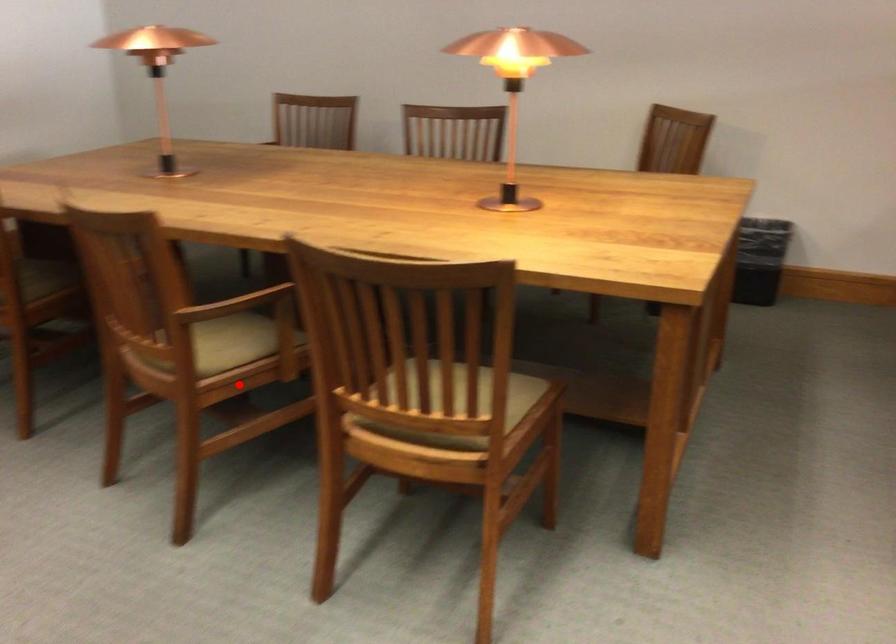
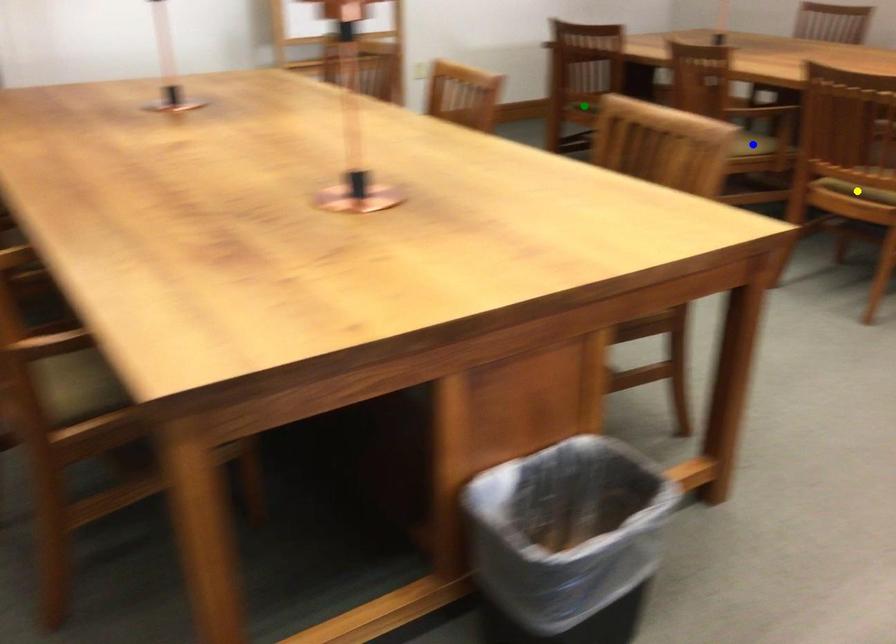
Question: I am providing you with two images of the same scene from different viewpoints. A red point is marked on the first image. You are given multiple points on the second image. Which spot in image 2 lines up with the point in image 1?

Choices:
 (A) blue point
 (B) green point
 (C) yellow point

Answer: (A)